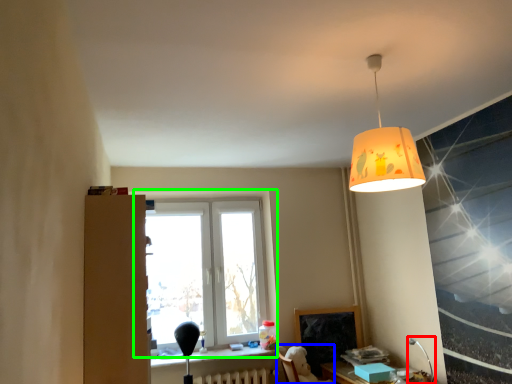
Question: Which object is the farthest from table lamp (highlighted by a red box)? Choose among these: swivel chair (highlighted by a blue box) or window (highlighted by a green box).

Choices:
 (A) swivel chair
 (B) window

Answer: (B)